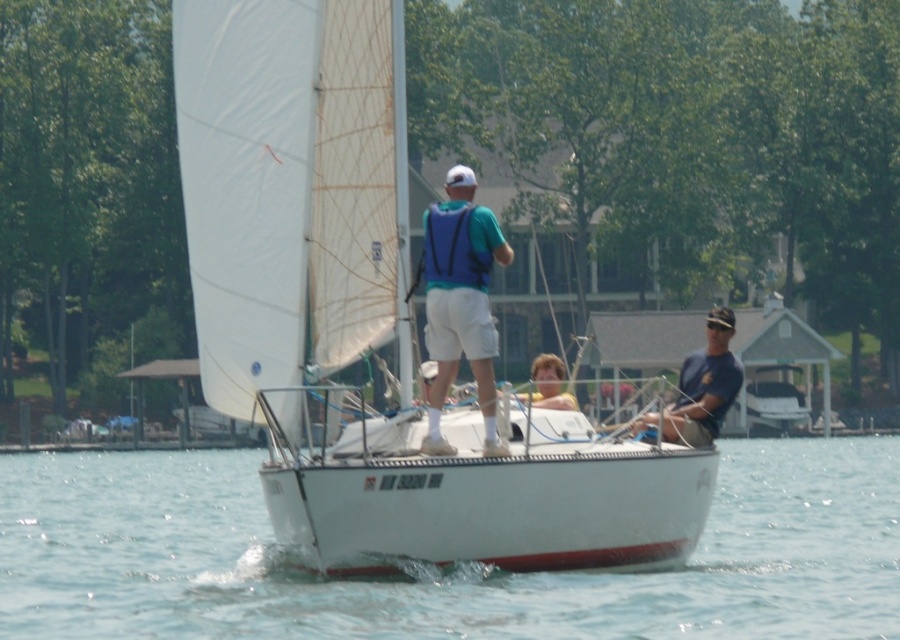
Question: Among these points, which one is nearest to the camera?

Choices:
 (A) (721, 349)
 (B) (551, 381)
 (C) (424, 236)
 (D) (686, 524)

Answer: (D)

Question: Which of the following is the closest to the observer?

Choices:
 (A) (637, 620)
 (B) (428, 278)

Answer: (A)

Question: Does white matte sailboat at center lie behind matte blue vest at center?

Choices:
 (A) no
 (B) yes

Answer: (A)

Question: Can you confirm if clear blue water at center is positioned to the left of smooth blonde hair at center?

Choices:
 (A) no
 (B) yes

Answer: (B)

Question: Among these points, which one is nearest to the camera?

Choices:
 (A) (490, 445)
 (B) (538, 403)
 (C) (689, 452)
 (D) (726, 401)

Answer: (A)

Question: Can you confirm if clear blue water at center is thinner than smooth blonde hair at center?

Choices:
 (A) no
 (B) yes

Answer: (A)